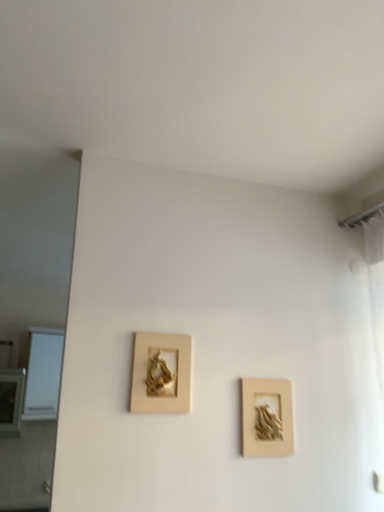
Question: From the image's perspective, is matte gold picture frame at center, arranged as the 2th picture frame when viewed from the right, located above white glass window at left?

Choices:
 (A) yes
 (B) no

Answer: (A)

Question: Is matte gold picture frame at center, acting as the first picture frame starting from the left, positioned in front of white glass window at left?

Choices:
 (A) no
 (B) yes

Answer: (B)

Question: From a real-world perspective, is matte gold picture frame at center, arranged as the 2th picture frame when viewed from the right, positioned under white glass window at left based on gravity?

Choices:
 (A) yes
 (B) no

Answer: (A)

Question: Is matte gold picture frame at center, acting as the first picture frame starting from the left, turned away from white glass window at left?

Choices:
 (A) yes
 (B) no

Answer: (A)

Question: Is matte gold picture frame at center, acting as the first picture frame starting from the left, taller than white glass window at left?

Choices:
 (A) no
 (B) yes

Answer: (A)

Question: Considering the positions of white glass window at left and beige matte picture frame at center-right, which is the 2th picture frame in left-to-right order, in the image, is white glass window at left taller or shorter than beige matte picture frame at center-right, which is the 2th picture frame in left-to-right order,?

Choices:
 (A) tall
 (B) short

Answer: (A)

Question: In terms of size, does white glass window at left appear bigger or smaller than beige matte picture frame at center-right, which is the 2th picture frame in left-to-right order?

Choices:
 (A) small
 (B) big

Answer: (B)

Question: Is white glass window at left situated inside beige matte picture frame at center-right, which is the 2th picture frame in left-to-right order, or outside?

Choices:
 (A) inside
 (B) outside

Answer: (B)

Question: Looking at their shapes, would you say white glass window at left is wider or thinner than beige matte picture frame at center-right, which is the 2th picture frame in left-to-right order?

Choices:
 (A) thin
 (B) wide

Answer: (B)

Question: Looking at their shapes, would you say matte gold picture frame at center, arranged as the 2th picture frame when viewed from the right, is wider or thinner than beige matte picture frame at center-right, which ranks as the 1th picture frame in right-to-left order?

Choices:
 (A) wide
 (B) thin

Answer: (A)

Question: From a real-world perspective, is matte gold picture frame at center, arranged as the 2th picture frame when viewed from the right, above or below beige matte picture frame at center-right, which is the 2th picture frame in left-to-right order?

Choices:
 (A) above
 (B) below

Answer: (A)

Question: From their relative heights in the image, would you say matte gold picture frame at center, arranged as the 2th picture frame when viewed from the right, is taller or shorter than beige matte picture frame at center-right, which is the 2th picture frame in left-to-right order?

Choices:
 (A) short
 (B) tall

Answer: (A)

Question: Considering the positions of matte gold picture frame at center, acting as the first picture frame starting from the left, and beige matte picture frame at center-right, which is the 2th picture frame in left-to-right order, in the image, is matte gold picture frame at center, acting as the first picture frame starting from the left, bigger or smaller than beige matte picture frame at center-right, which is the 2th picture frame in left-to-right order,?

Choices:
 (A) small
 (B) big

Answer: (B)

Question: Is matte gold picture frame at center, acting as the first picture frame starting from the left, to the left or to the right of white glass window at left in the image?

Choices:
 (A) left
 (B) right

Answer: (B)

Question: In the image, is matte gold picture frame at center, acting as the first picture frame starting from the left, positioned in front of or behind white glass window at left?

Choices:
 (A) front
 (B) behind

Answer: (A)